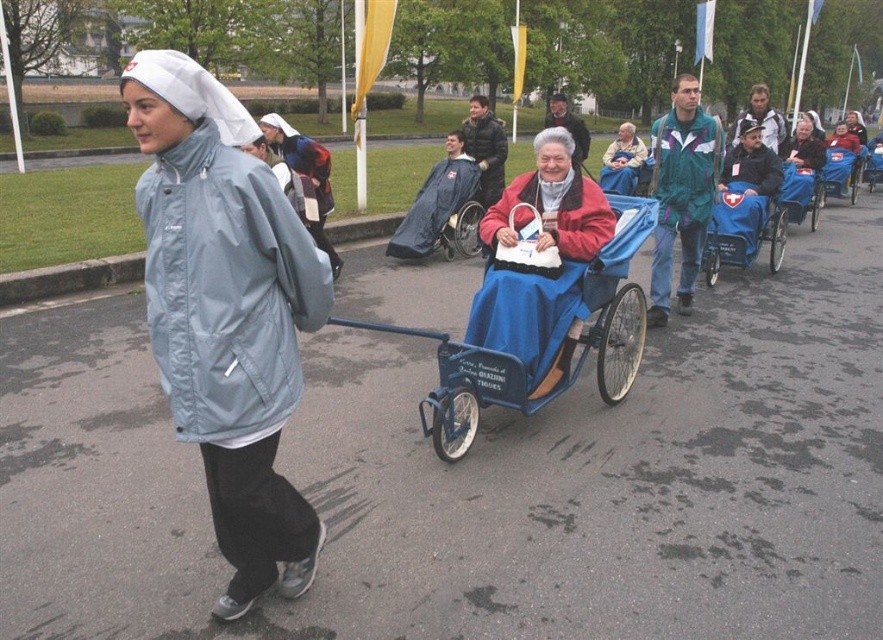
You are organizing a community event and need to arrange seating for attendees. Given the space constraints, which object between the blue fabric baby carriage at center and the blue fabric coach at center would require more space to accommodate?

The blue fabric coach at center requires more space because it occupies more space than the blue fabric baby carriage at center.

You are a participant in the community event and need to locate the blue wheelchair at center. According to the image, where is the blue wheelchair at center located in relation to the point with coordinates (462, 212)?

The blue wheelchair at center is located exactly at the point with coordinates (462, 212).

You are a photographer at the event and want to capture both the light blue fabric jacket at left and the light blue fabric wheelchair at center in a single shot. Based on their positions, which one would appear closer to the camera in the photo?

The light blue fabric jacket at left would appear closer to the camera because it is positioned in front of the light blue fabric wheelchair at center.